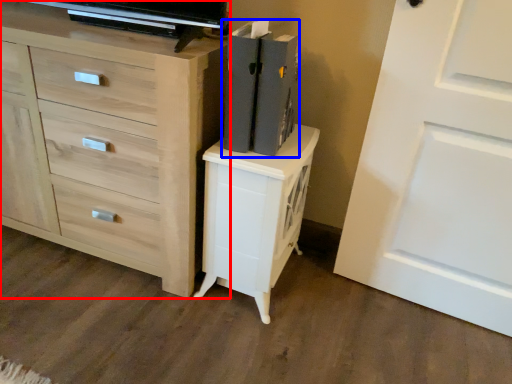
Question: Which object appears farthest to the camera in this image, chest of drawers (highlighted by a red box) or book (highlighted by a blue box)?

Choices:
 (A) chest of drawers
 (B) book

Answer: (B)